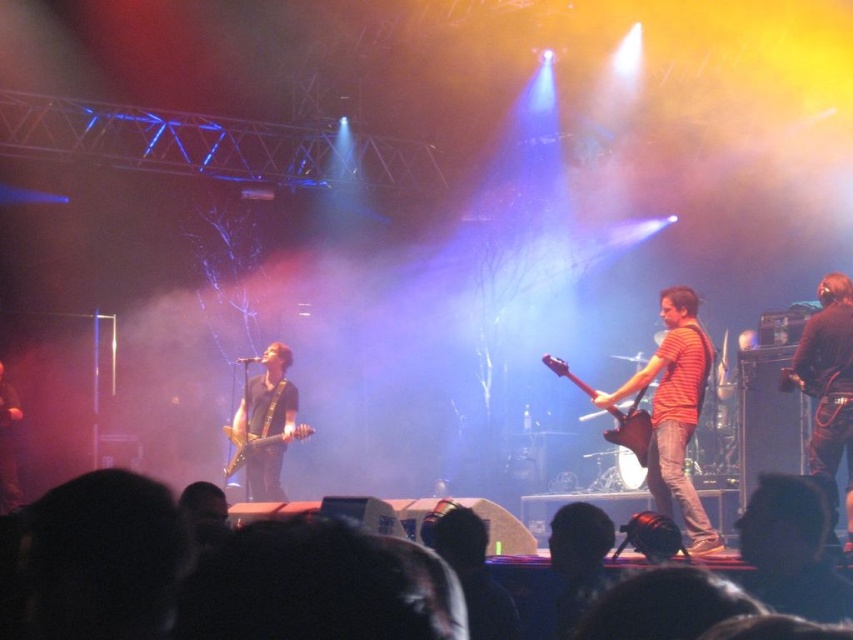
You are an audience member sitting in the front row. You see two jackets on stage, the black leather jacket at right and the dark brown leather jacket at left. Which jacket is closer to the right side of the stage?

The black leather jacket at right is positioned on the right side of the dark brown leather jacket at left, so it is closer to the right side of the stage.

You are standing at the center of the stage and want to move to the point marked as point (689, 324). However, there is an obstacle at point (294, 410). Will you be able to walk straight to your destination without passing by the obstacle?

Since point (689, 324) is in front of point (294, 410), you will pass by the obstacle at point (294, 410) on your way to the destination.

Looking at this image, you are a photographer trying to capture the musician in the orange striped shirt at center and the musician in the black leather jacket at right. If you want to frame both in a single shot, which musician should you position closer to the camera to ensure their clothing details are visible?

The orange striped shirt at center has a larger width than the black leather jacket at right. To ensure both are visible in the frame, you should position the black leather jacket at right closer to the camera since its smaller size requires less space compared to the wider orange striped shirt at center.